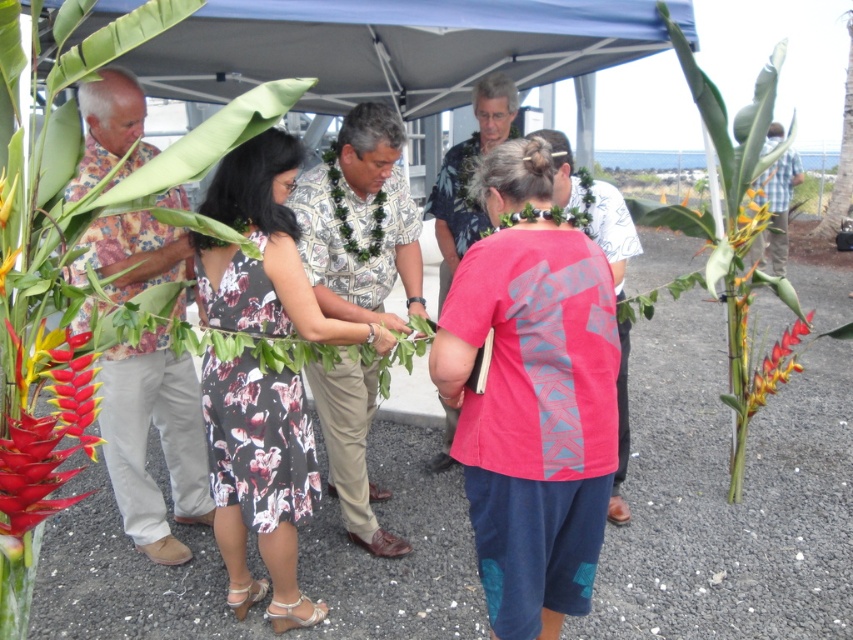
Question: Which point appears farthest from the camera in this image?

Choices:
 (A) (758, 177)
 (B) (752, 374)
 (C) (762, 84)

Answer: (A)

Question: Can you confirm if floral dress at center is positioned below bright orange and yellow petals at center?

Choices:
 (A) no
 (B) yes

Answer: (B)

Question: Which point is closer to the camera?

Choices:
 (A) (779, 260)
 (B) (795, 342)
 (C) (16, 173)
 (D) (776, 346)

Answer: (C)

Question: Can you confirm if printed fabric shirt at center is positioned below plaid shirt at center?

Choices:
 (A) no
 (B) yes

Answer: (B)

Question: Can you confirm if floral dress at center is thinner than bright orange and yellow petals at center?

Choices:
 (A) yes
 (B) no

Answer: (B)

Question: Estimate the real-world distances between objects in this image. Which object is closer to the blue fabric canopy at upper center?

Choices:
 (A) yellow-green leafy plant at center
 (B) vibrant red and yellow flower at center
 (C) floral dress at center
 (D) printed fabric shirt at center

Answer: (D)